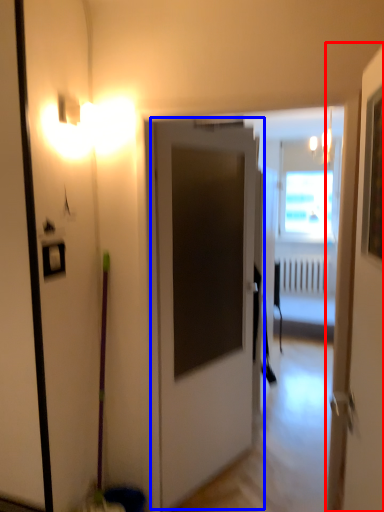
Question: Which of the following is the farthest to the observer, door (highlighted by a red box) or door (highlighted by a blue box)?

Choices:
 (A) door
 (B) door

Answer: (B)